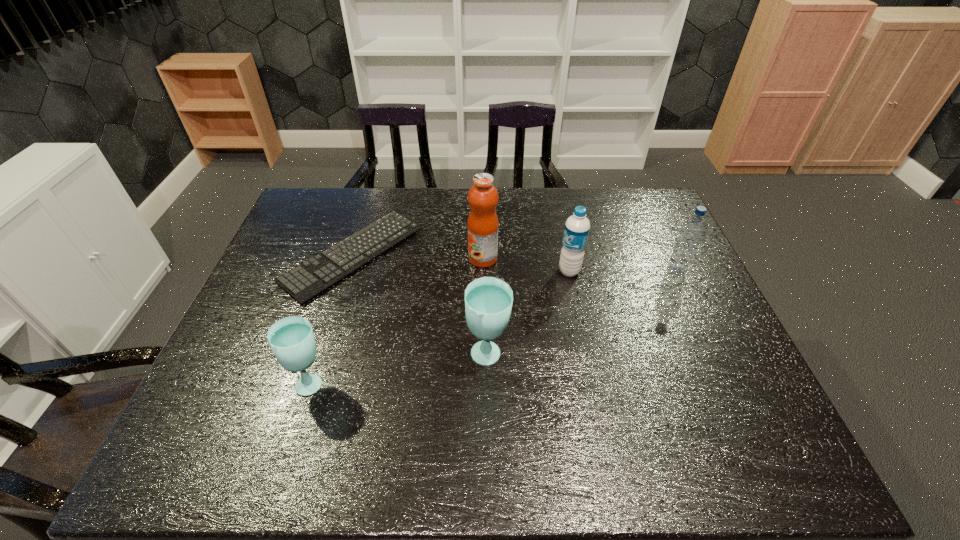
The image size is (960, 540). I want to click on empty space between the second shortest object and the fruit juice, so [x=397, y=320].

The height and width of the screenshot is (540, 960). In order to click on vacant space that's between the shortest object and the right glass in this screenshot , I will do `click(420, 306)`.

Where is `vacant area between the second object from right to left and the left glass`? The image size is (960, 540). vacant area between the second object from right to left and the left glass is located at coordinates (441, 327).

What are the coordinates of `vacant space that is in between the right water bottle and the fifth object from left to right` in the screenshot? It's located at (623, 271).

Locate an element on the screen. free spot between the shortest object and the rightmost object is located at coordinates (515, 263).

I want to click on unoccupied position between the rightmost object and the right glass, so click(582, 314).

Identify the location of free space between the computer keyboard and the left water bottle. The width and height of the screenshot is (960, 540). (462, 263).

Find the location of a particular element. The width and height of the screenshot is (960, 540). free space between the computer keyboard and the tallest object is located at coordinates (419, 256).

Select which object appears as the second closest to the second object from right to left. Please provide its 2D coordinates. Your answer should be formatted as a tuple, i.e. [(x, y)], where the tuple contains the x and y coordinates of a point satisfying the conditions above.

[(691, 233)]

Identify the location of object that stands as the third closest to the right water bottle. The width and height of the screenshot is (960, 540). pyautogui.click(x=488, y=300).